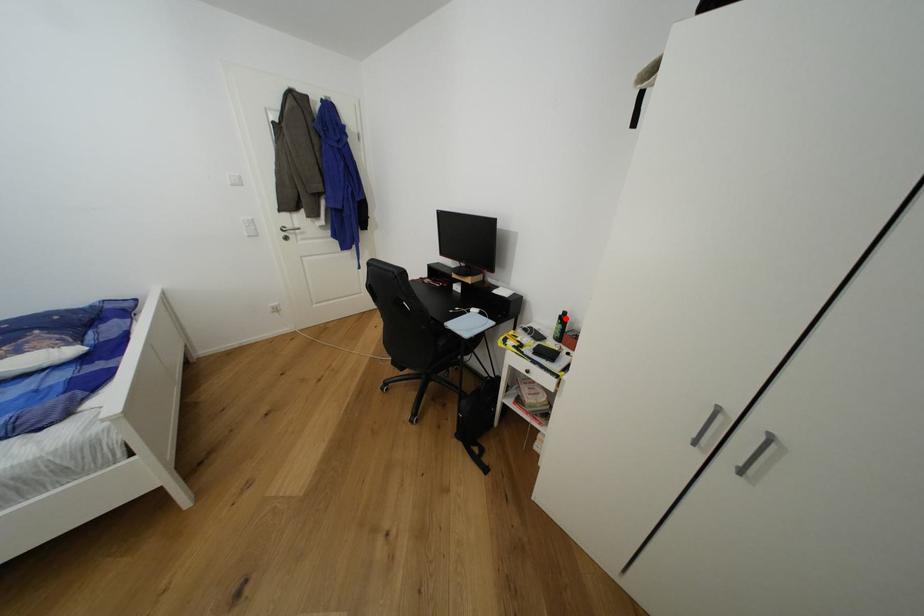
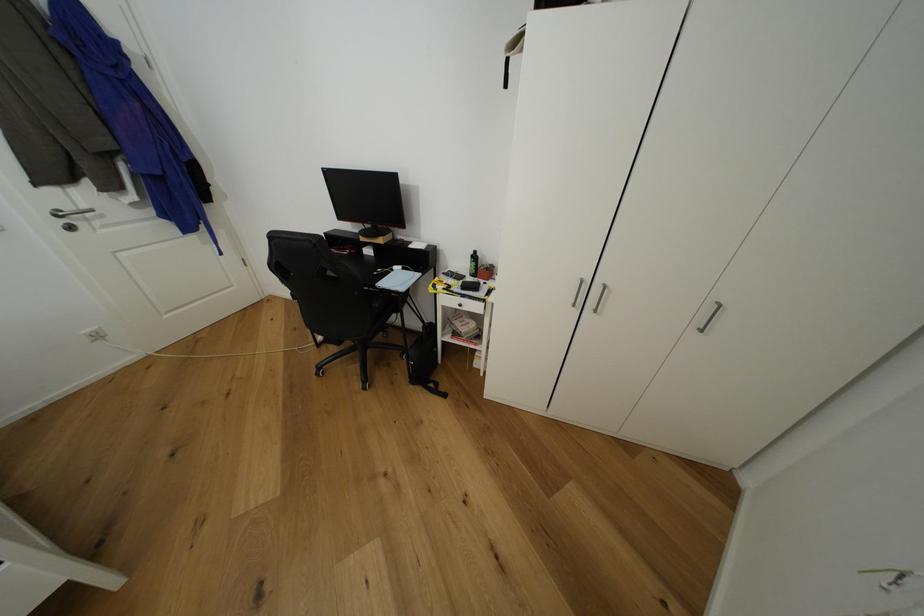
Where in the second image is the point corresponding to the highlighted location from the first image?

(478, 257)